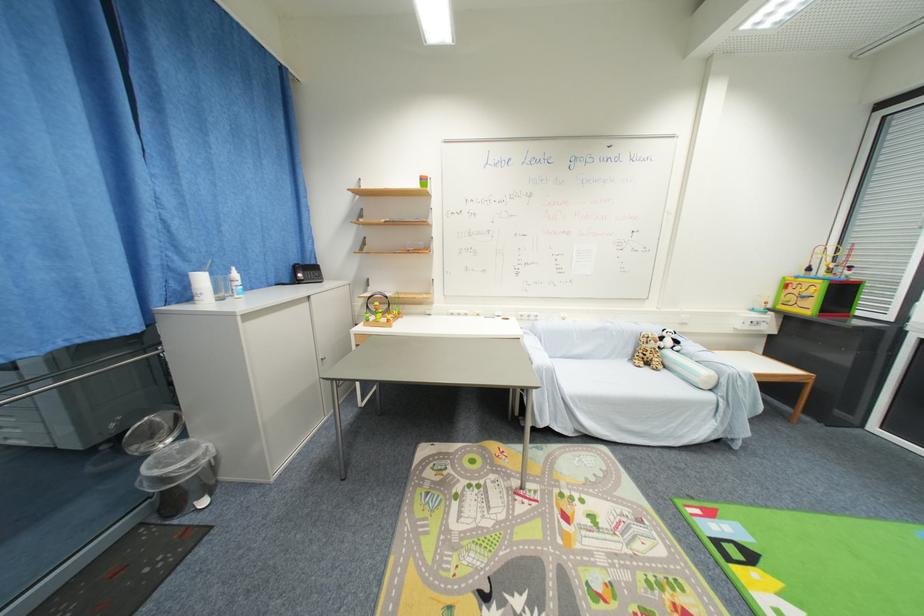
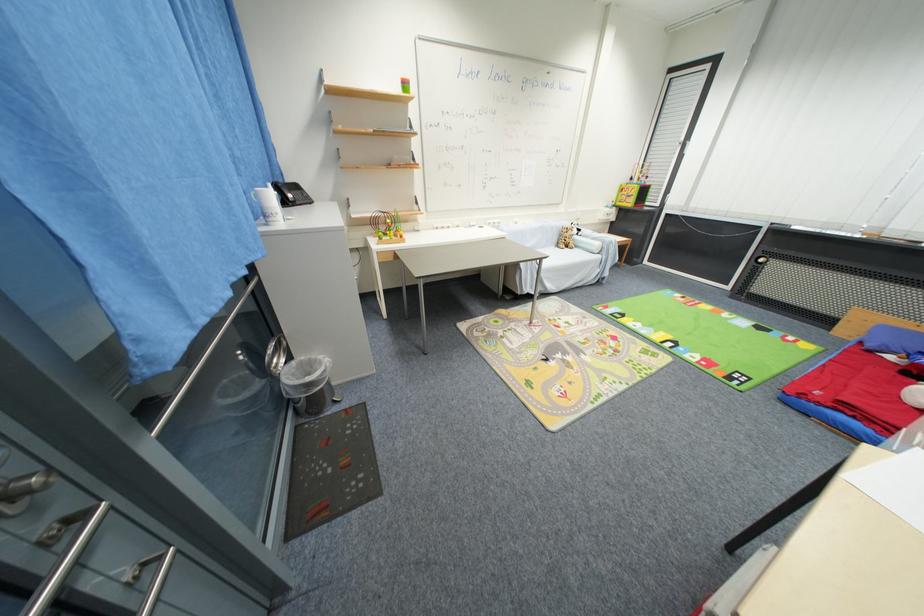
The point at [811,310] is marked in the first image. Where is the corresponding point in the second image?

(635, 206)